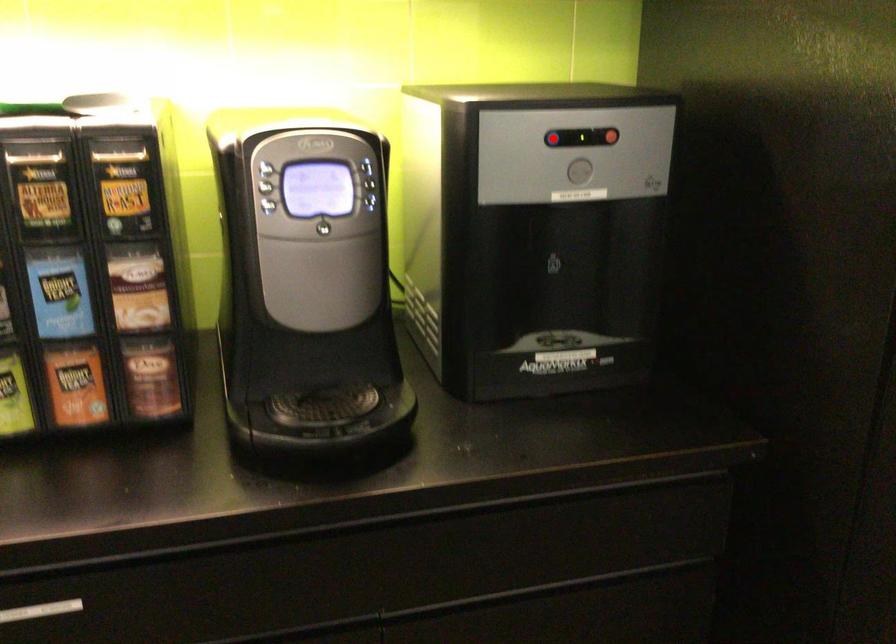
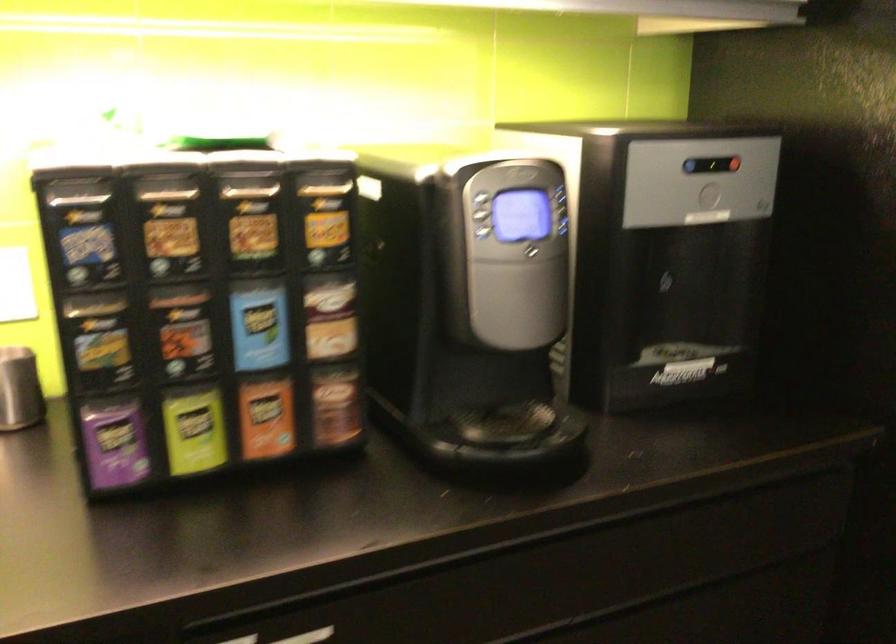
In the second image, find the point that corresponds to the highlighted location in the first image.

(691, 166)